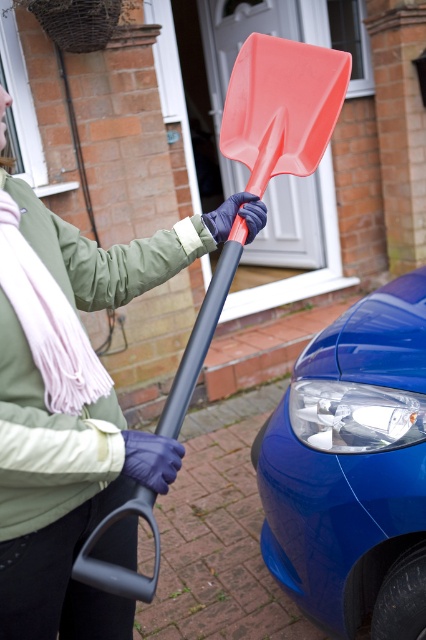
Question: Is glossy blue car at lower right bigger than rubberized plastic shovel at center?

Choices:
 (A) no
 (B) yes

Answer: (B)

Question: Which point is farther to the camera?

Choices:
 (A) glossy blue car at lower right
 (B) rubberized plastic shovel at center

Answer: (A)

Question: Does glossy blue car at lower right come behind rubberized plastic shovel at center?

Choices:
 (A) yes
 (B) no

Answer: (A)

Question: Which of the following is the farthest from the observer?

Choices:
 (A) rubberized plastic shovel at center
 (B) glossy blue car at lower right

Answer: (B)

Question: Does glossy blue car at lower right appear on the left side of rubberized plastic shovel at center?

Choices:
 (A) yes
 (B) no

Answer: (B)

Question: Which point is closer to the camera?

Choices:
 (A) (256, 180)
 (B) (394, 353)

Answer: (A)